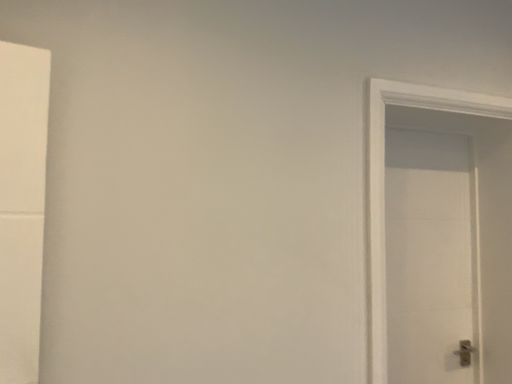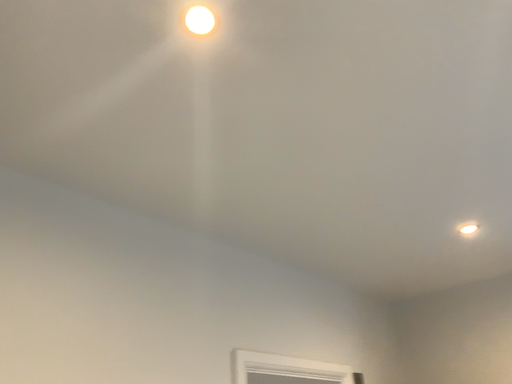
Question: How did the camera likely rotate when shooting the video?

Choices:
 (A) rotated downward
 (B) rotated upward

Answer: (B)